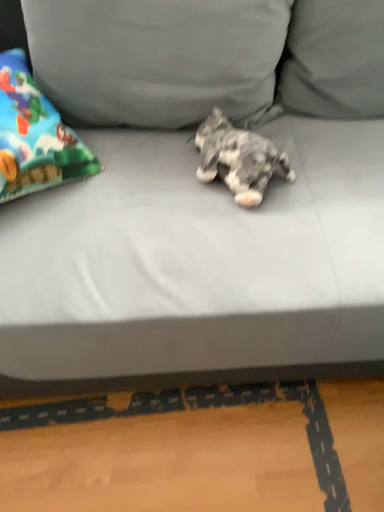
Question: Is point (226, 161) positioned closer to the camera than point (185, 178)?

Choices:
 (A) closer
 (B) farther

Answer: (A)

Question: In terms of size, does fluffy gray dog at center appear bigger or smaller than gray fabric couch at center?

Choices:
 (A) small
 (B) big

Answer: (A)

Question: Estimate the real-world distances between objects in this image. Which object is farther from the gray fabric pillow at upper center?

Choices:
 (A) gray fabric couch at center
 (B) fluffy gray dog at center

Answer: (B)

Question: Considering the real-world distances, which object is farthest from the gray fabric couch at center?

Choices:
 (A) gray fabric pillow at upper center
 (B) fluffy gray dog at center

Answer: (B)